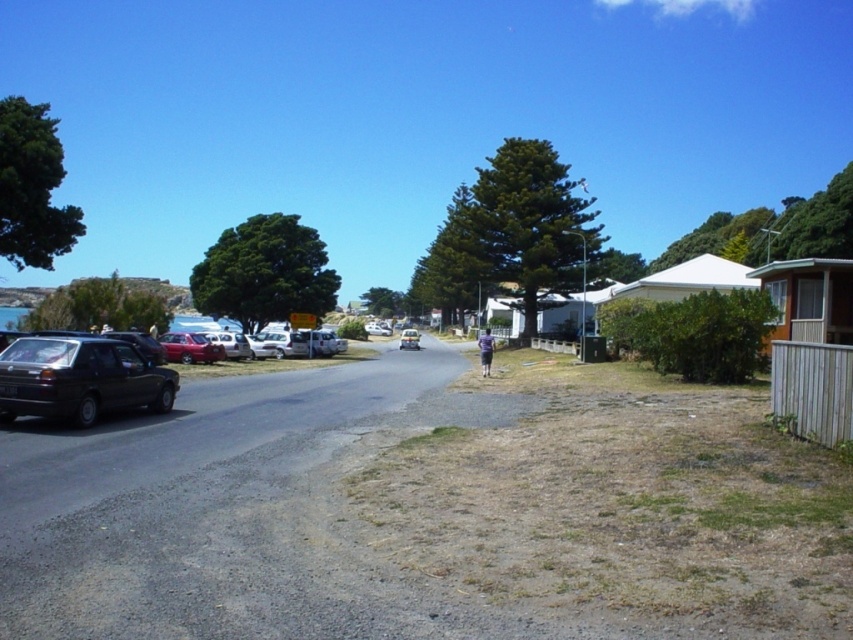
Question: Considering the real-world distances, which object is closest to the metallic red car at left?

Choices:
 (A) white matte car at center
 (B) purple fabric person at center

Answer: (A)

Question: Does silver metallic car at center appear on the left side of metallic silver car at center?

Choices:
 (A) yes
 (B) no

Answer: (A)

Question: Which of these objects is positioned farthest from the matte black car at left?

Choices:
 (A) purple fabric person at center
 (B) white matte car at center

Answer: (B)

Question: Is matte black car at left thinner than purple fabric person at center?

Choices:
 (A) no
 (B) yes

Answer: (B)

Question: Which of the following is the farthest from the observer?

Choices:
 (A) (238, 342)
 (B) (137, 380)

Answer: (A)

Question: Is the position of matte black car at left more distant than that of white matte car at center?

Choices:
 (A) no
 (B) yes

Answer: (A)